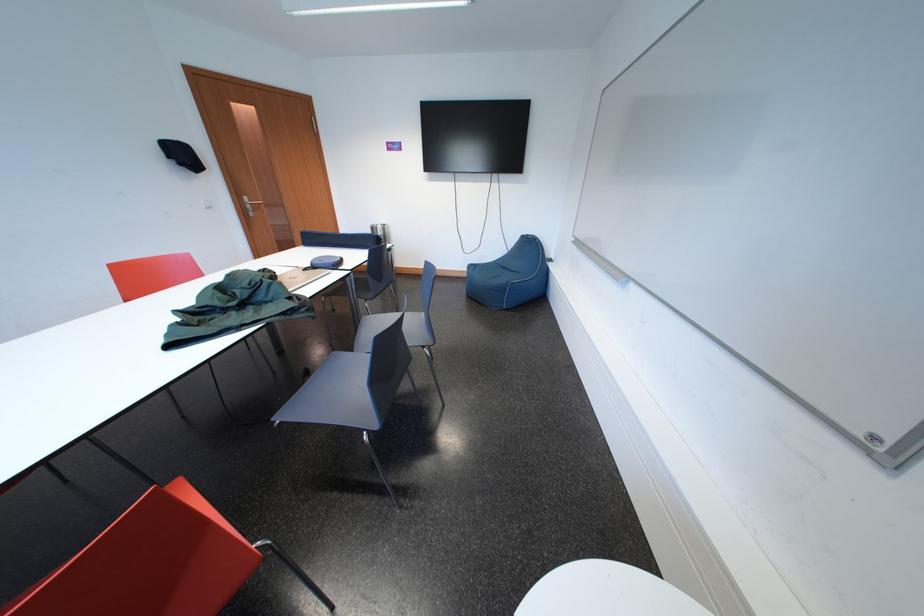
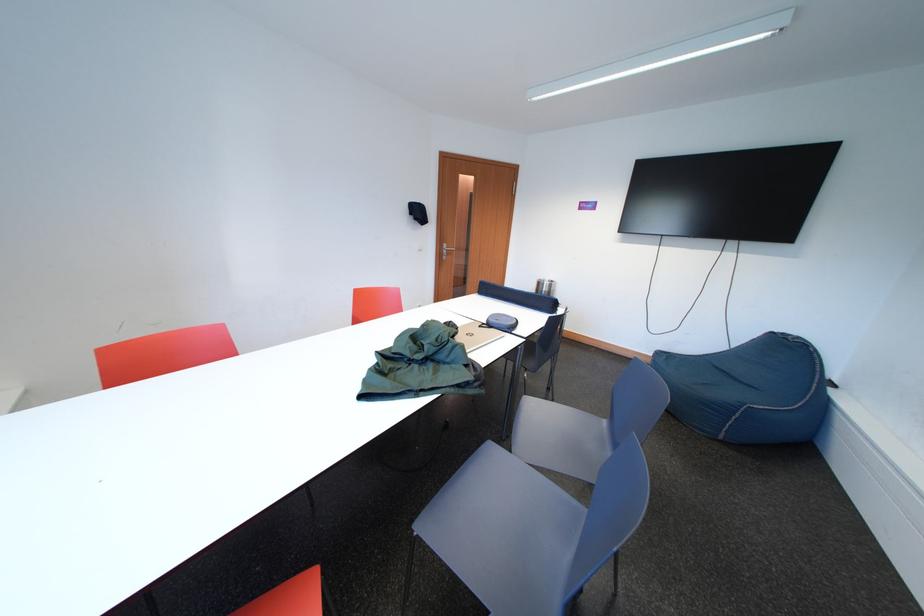
Locate, in the second image, the point that corresponds to the point at 254,203 in the first image.

(455, 249)